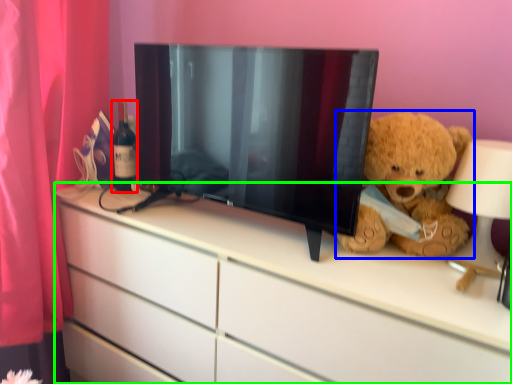
Question: Estimate the real-world distances between objects in this image. Which object is farther from bottle (highlighted by a red box), teddy bear (highlighted by a blue box) or chest of drawers (highlighted by a green box)?

Choices:
 (A) teddy bear
 (B) chest of drawers

Answer: (A)